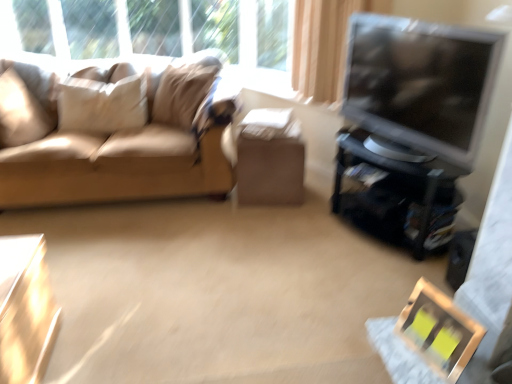
I want to click on vacant region to the left of wooden picture frame at lower right, so tap(370, 354).